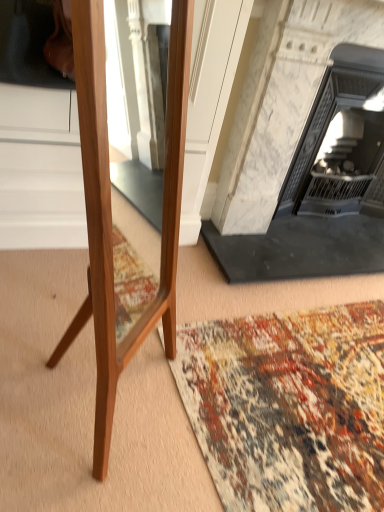
Question: Is multicolored woven rug at lower center wider or thinner than white marble fireplace at center, the 2th fireplace in the right-to-left sequence?

Choices:
 (A) wide
 (B) thin

Answer: (A)

Question: Based on their sizes in the image, would you say multicolored woven rug at lower center is bigger or smaller than white marble fireplace at center, arranged as the 1th fireplace when viewed from the left?

Choices:
 (A) big
 (B) small

Answer: (B)

Question: Which of these objects is positioned farthest from the white marble fireplace at upper right, the 2th fireplace viewed from the left?

Choices:
 (A) multicolored woven rug at lower center
 (B) white marble fireplace at center, the 2th fireplace in the right-to-left sequence

Answer: (A)

Question: Which is farther from the white marble fireplace at center, the 2th fireplace in the right-to-left sequence?

Choices:
 (A) white marble fireplace at upper right, the 2th fireplace viewed from the left
 (B) multicolored woven rug at lower center

Answer: (B)